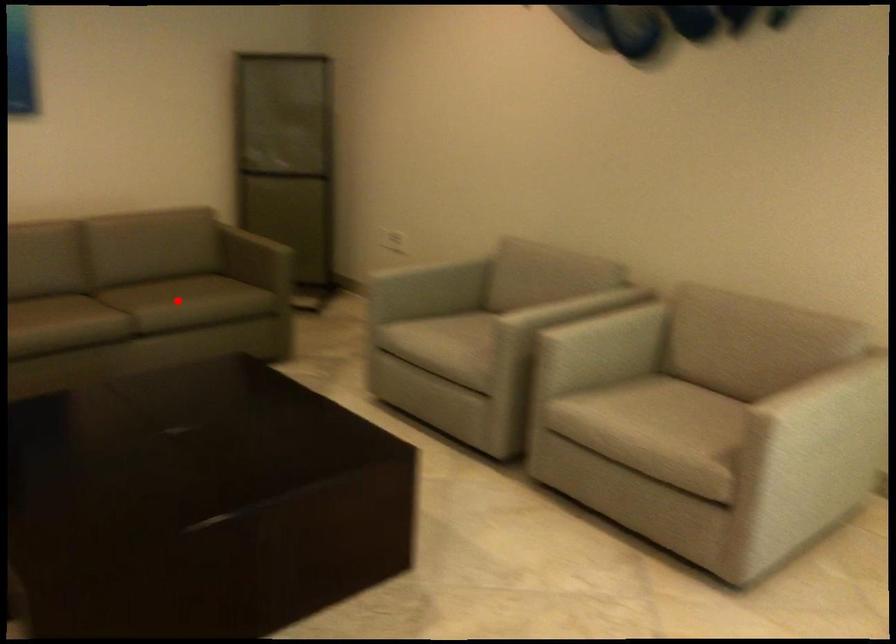
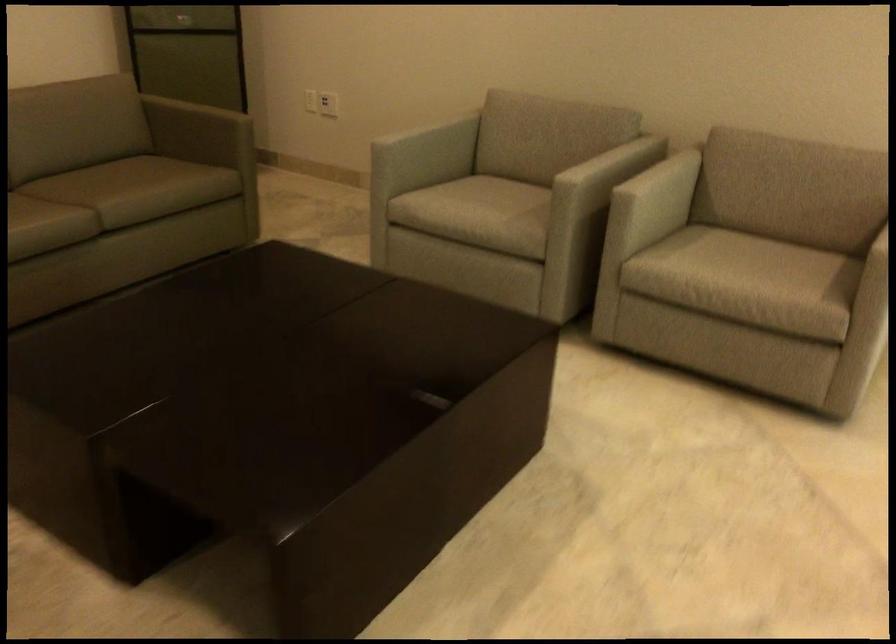
Question: I am providing you with two images of the same scene from different viewpoints. A red point is shown in image1. For the corresponding object point in image2, is it positioned nearer or farther from the camera?

Choices:
 (A) Nearer
 (B) Farther

Answer: (A)